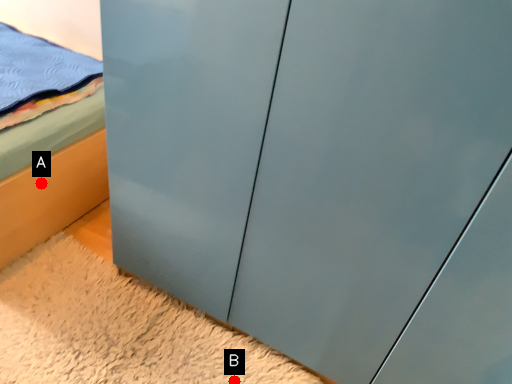
Question: Two points are circled on the image, labeled by A and B beside each circle. Which of the following is the closest to the observer?

Choices:
 (A) A is closer
 (B) B is closer

Answer: (B)